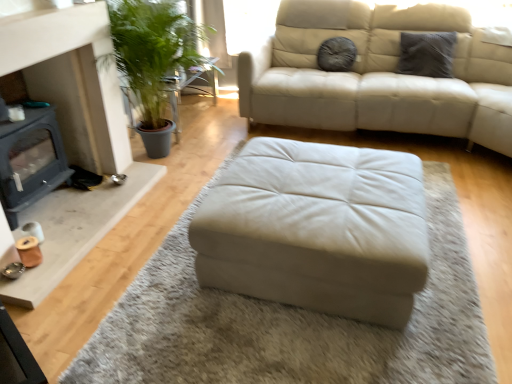
Question: Does fuzzy gray pillow at upper center, which is the 1th pillow from left to right, come in front of green leafy plant at left?

Choices:
 (A) no
 (B) yes

Answer: (A)

Question: From the image's perspective, is fuzzy gray pillow at upper center, which is counted as the second pillow, starting from the right, above green leafy plant at left?

Choices:
 (A) yes
 (B) no

Answer: (A)

Question: Could green leafy plant at left be considered to be inside fuzzy gray pillow at upper center, which is the 1th pillow from left to right?

Choices:
 (A) no
 (B) yes

Answer: (A)

Question: Can you confirm if fuzzy gray pillow at upper center, which is the 1th pillow from left to right, is thinner than green leafy plant at left?

Choices:
 (A) yes
 (B) no

Answer: (A)

Question: Does fuzzy gray pillow at upper center, which is counted as the second pillow, starting from the right, have a smaller size compared to green leafy plant at left?

Choices:
 (A) no
 (B) yes

Answer: (B)

Question: From a real-world perspective, is matte gray fireplace at lower left above or below beige leather ottoman at center?

Choices:
 (A) below
 (B) above

Answer: (B)

Question: From the image's perspective, is matte gray fireplace at lower left located above or below beige leather ottoman at center?

Choices:
 (A) below
 (B) above

Answer: (B)

Question: Considering the positions of point (36, 188) and point (300, 177), is point (36, 188) closer or farther from the camera than point (300, 177)?

Choices:
 (A) farther
 (B) closer

Answer: (A)

Question: In the image, is matte gray fireplace at lower left positioned in front of or behind beige leather ottoman at center?

Choices:
 (A) front
 (B) behind

Answer: (B)

Question: Visually, is green leafy plant at left positioned to the left or to the right of matte gray fireplace at lower left?

Choices:
 (A) right
 (B) left

Answer: (A)

Question: From a real-world perspective, is green leafy plant at left physically located above or below matte gray fireplace at lower left?

Choices:
 (A) below
 (B) above

Answer: (A)

Question: Would you say green leafy plant at left is inside or outside matte gray fireplace at lower left?

Choices:
 (A) outside
 (B) inside

Answer: (A)

Question: Based on their sizes in the image, would you say green leafy plant at left is bigger or smaller than matte gray fireplace at lower left?

Choices:
 (A) big
 (B) small

Answer: (A)

Question: Considering their positions, is gray textured pillow at upper right, arranged as the 2th pillow when viewed from the left, located in front of or behind green leafy plant at left?

Choices:
 (A) front
 (B) behind

Answer: (A)

Question: Considering the positions of gray textured pillow at upper right, arranged as the 2th pillow when viewed from the left, and green leafy plant at left in the image, is gray textured pillow at upper right, arranged as the 2th pillow when viewed from the left, bigger or smaller than green leafy plant at left?

Choices:
 (A) big
 (B) small

Answer: (B)